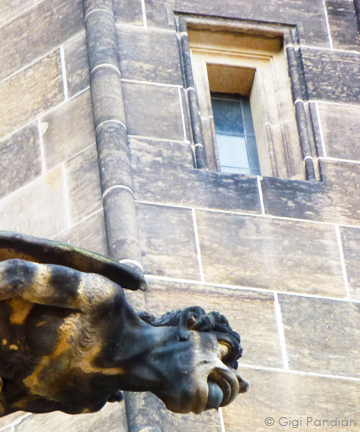
Find the location of a particular element. The width and height of the screenshot is (360, 432). grout is located at coordinates (281, 337).